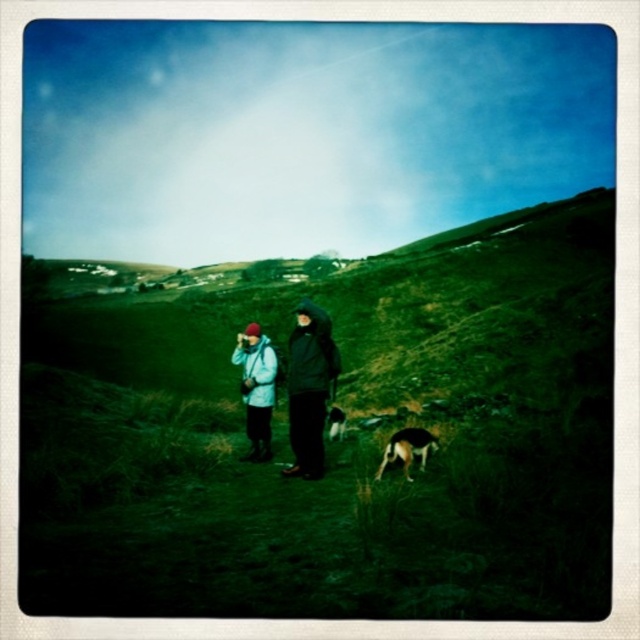
Question: Observing the image, what is the correct spatial positioning of brown fur dog at lower center in reference to brown fur dog at center?

Choices:
 (A) above
 (B) below

Answer: (A)

Question: Can you confirm if light blue fabric jacket at center is positioned to the right of brown fur dog at lower center?

Choices:
 (A) yes
 (B) no

Answer: (B)

Question: Estimate the real-world distances between objects in this image. Which object is closer to the matte black jacket at center?

Choices:
 (A) brown fur dog at lower center
 (B) light blue fabric jacket at center
 (C) brown fur dog at center

Answer: (A)

Question: Which of the following is the farthest from the observer?

Choices:
 (A) brown fur dog at lower center
 (B) light blue fabric jacket at center
 (C) brown fur dog at center

Answer: (C)

Question: Among these objects, which one is nearest to the camera?

Choices:
 (A) light blue fabric jacket at center
 (B) brown fur dog at center

Answer: (A)

Question: From the image, what is the correct spatial relationship of brown fur dog at lower center in relation to brown fur dog at center?

Choices:
 (A) right
 (B) left

Answer: (A)